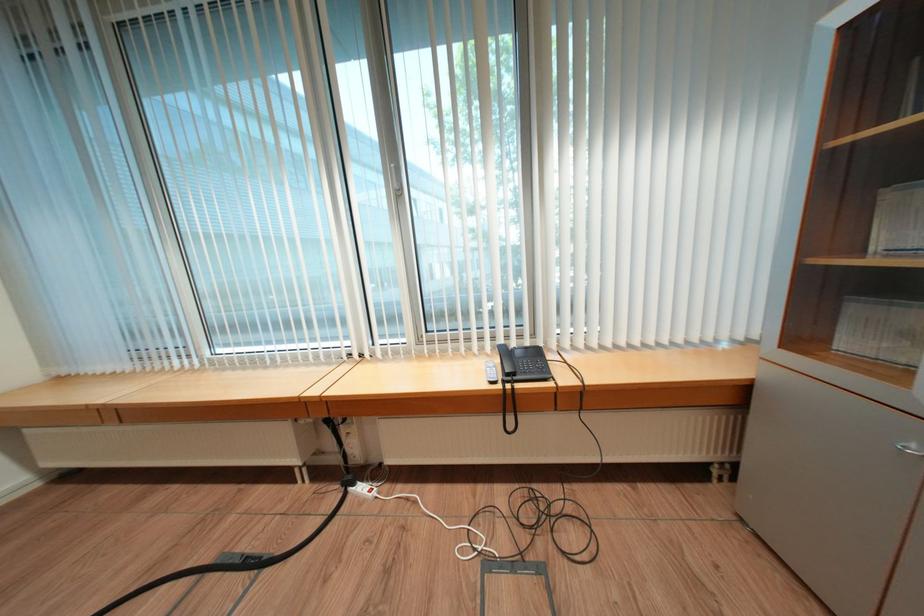
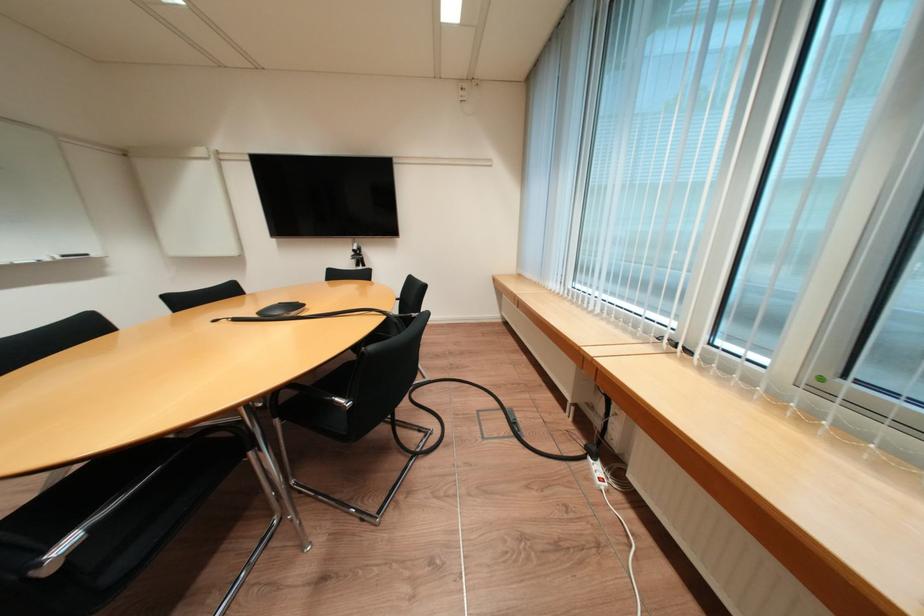
In the second image, find the point that corresponds to point 359,490 in the first image.

(598, 459)